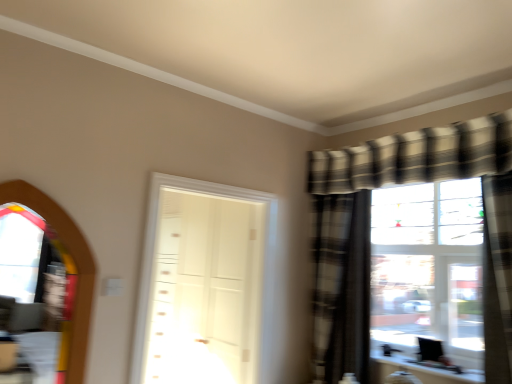
Question: From the image's perspective, would you say plaid fabric curtain at right, which is the first curtain in left-to-right order, is positioned over white glossy door at center?

Choices:
 (A) yes
 (B) no

Answer: (B)

Question: Could you tell me if plaid fabric curtain at right, which is the first curtain in left-to-right order, is facing white glossy door at center?

Choices:
 (A) yes
 (B) no

Answer: (B)

Question: Are plaid fabric curtain at right, which is the first curtain in left-to-right order, and white glossy door at center beside each other?

Choices:
 (A) yes
 (B) no

Answer: (B)

Question: Is plaid fabric curtain at right, which is the first curtain in left-to-right order, thinner than white glossy door at center?

Choices:
 (A) yes
 (B) no

Answer: (A)

Question: Is plaid fabric curtain at right, the 2th curtain viewed from the right, not near white glossy door at center?

Choices:
 (A) yes
 (B) no

Answer: (B)

Question: Is plaid fabric curtain at right, which is the first curtain in left-to-right order, smaller than white glossy door at center?

Choices:
 (A) yes
 (B) no

Answer: (A)

Question: Does plaid fabric curtain at right, the second curtain viewed from the left, appear on the right side of white glossy door at center?

Choices:
 (A) yes
 (B) no

Answer: (A)

Question: Does plaid fabric curtain at right, placed as the first curtain when sorted from right to left, come behind white glossy door at center?

Choices:
 (A) yes
 (B) no

Answer: (B)

Question: Does plaid fabric curtain at right, the first curtain from the front, contain white glossy door at center?

Choices:
 (A) no
 (B) yes

Answer: (A)

Question: Can you confirm if plaid fabric curtain at right, the first curtain from the front, is wider than white glossy door at center?

Choices:
 (A) no
 (B) yes

Answer: (A)

Question: From a real-world perspective, is plaid fabric curtain at right, placed as the first curtain when sorted from right to left, physically below white glossy door at center?

Choices:
 (A) yes
 (B) no

Answer: (B)

Question: Is plaid fabric curtain at right, which appears as the second curtain when viewed from the back, smaller than white glossy door at center?

Choices:
 (A) no
 (B) yes

Answer: (B)

Question: From a real-world perspective, is transparent glass window screen at left located beneath white glossy door at center?

Choices:
 (A) no
 (B) yes

Answer: (A)